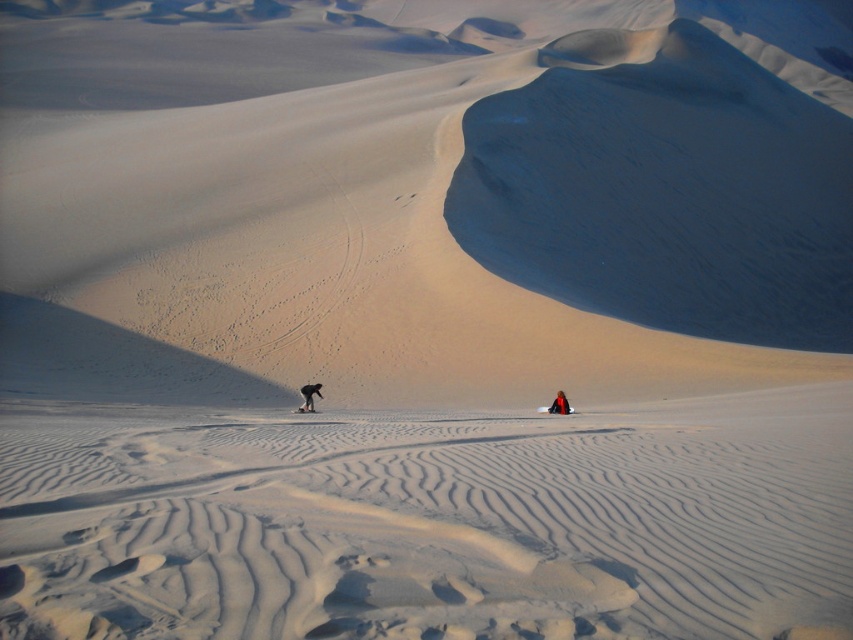
You are standing at the center of the desert scene. There is an orange fabric person at lower right. Where exactly is the orange fabric person located in terms of coordinates?

The orange fabric person at lower right is located at coordinates point (560, 404).

You are standing in the desert scene and want to take a photo of the orange fabric person at lower right without the smooth sand dune at center blocking the view. Is this possible?

The smooth sand dune at center is above the orange fabric person at lower right, so you can position yourself lower to avoid the dune blocking the view of the person.